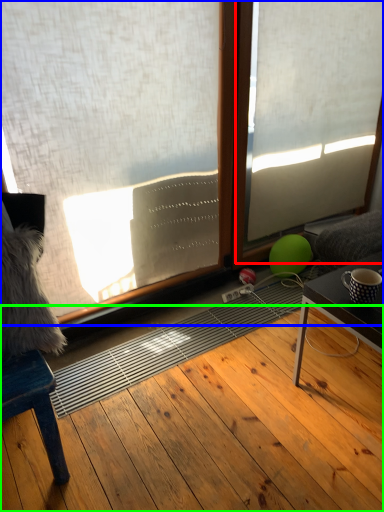
Question: Considering the real-world distances, which object is closest to window frame (highlighted by a red box)? window (highlighted by a blue box) or hardwood (highlighted by a green box).

Choices:
 (A) window
 (B) hardwood

Answer: (A)